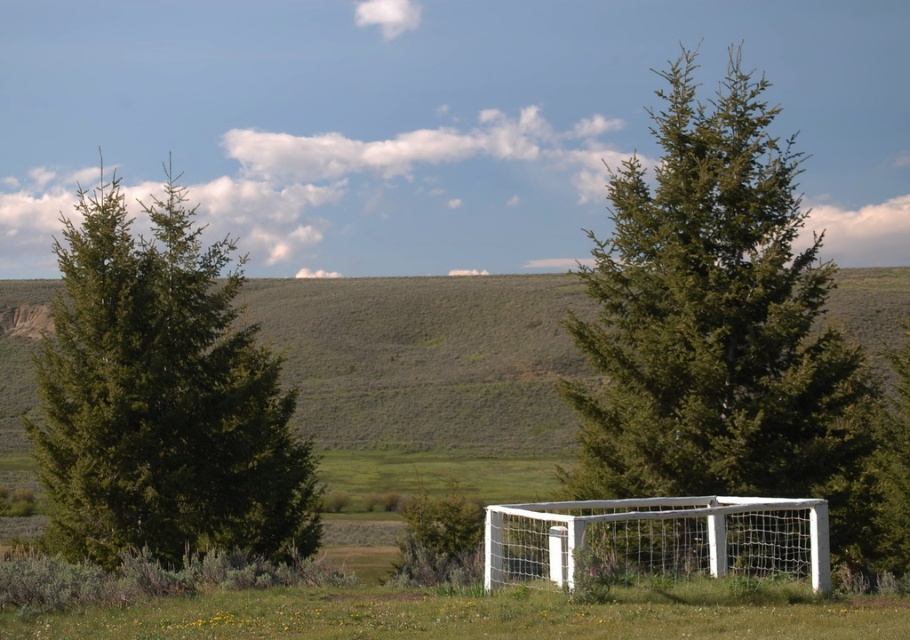
Does green matte tree at left have a lesser height compared to white mesh net at center?

No, green matte tree at left is not shorter than white mesh net at center.

This screenshot has height=640, width=910. What do you see at coordinates (162, 397) in the screenshot?
I see `green matte tree at left` at bounding box center [162, 397].

Where is `green matte tree at left`? The width and height of the screenshot is (910, 640). green matte tree at left is located at coordinates (162, 397).

Can you confirm if green matte tree at center is taller than white mesh net at center?

Yes.

Which is more to the left, green matte tree at center or white mesh net at center?

white mesh net at center is more to the left.

Locate an element on the screen. The width and height of the screenshot is (910, 640). green matte tree at center is located at coordinates (719, 324).

The image size is (910, 640). In order to click on green matte tree at center in this screenshot , I will do `click(719, 324)`.

Between point (241, 492) and point (341, 433), which one is positioned behind?

Positioned behind is point (341, 433).

Does point (102, 512) come farther from viewer compared to point (290, 349)?

No.

Locate an element on the screen. Image resolution: width=910 pixels, height=640 pixels. green matte tree at left is located at coordinates (162, 397).